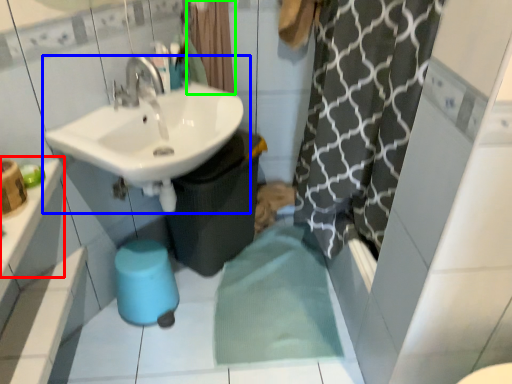
Question: Which object is the farthest from counter top (highlighted by a red box)? Choose among these: sink (highlighted by a blue box) or shower curtain (highlighted by a green box).

Choices:
 (A) sink
 (B) shower curtain

Answer: (B)